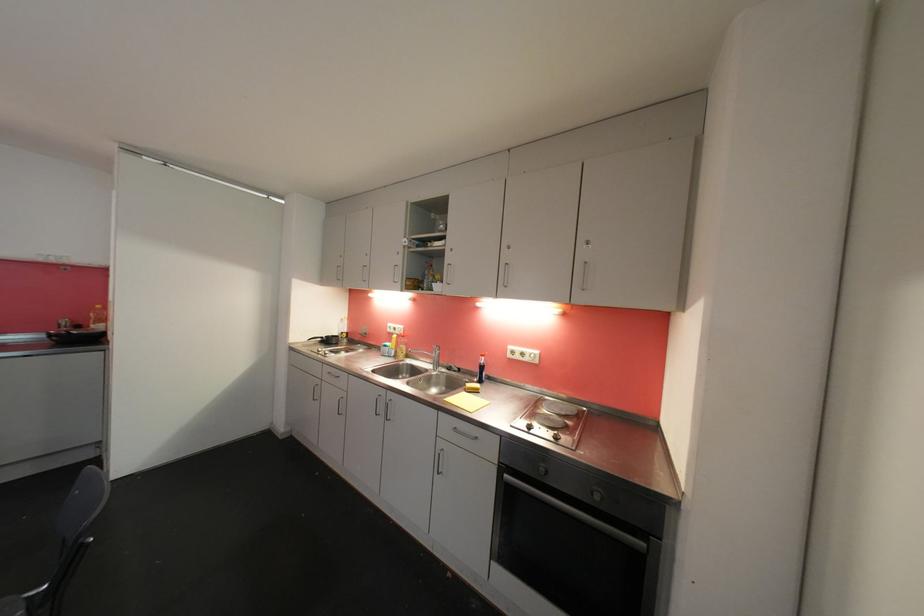
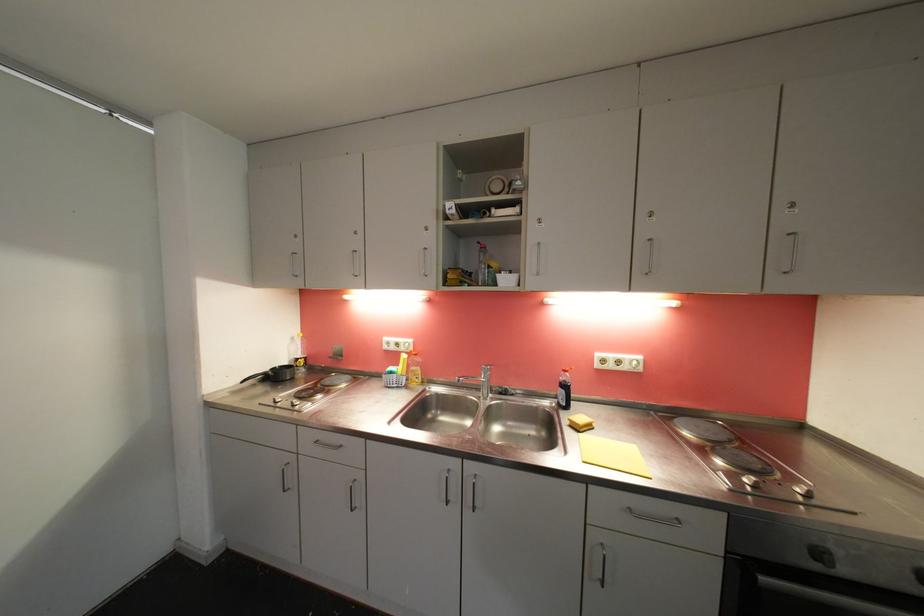
What movement of the cameraman would produce the second image?

The cameraman walked toward left, forward.